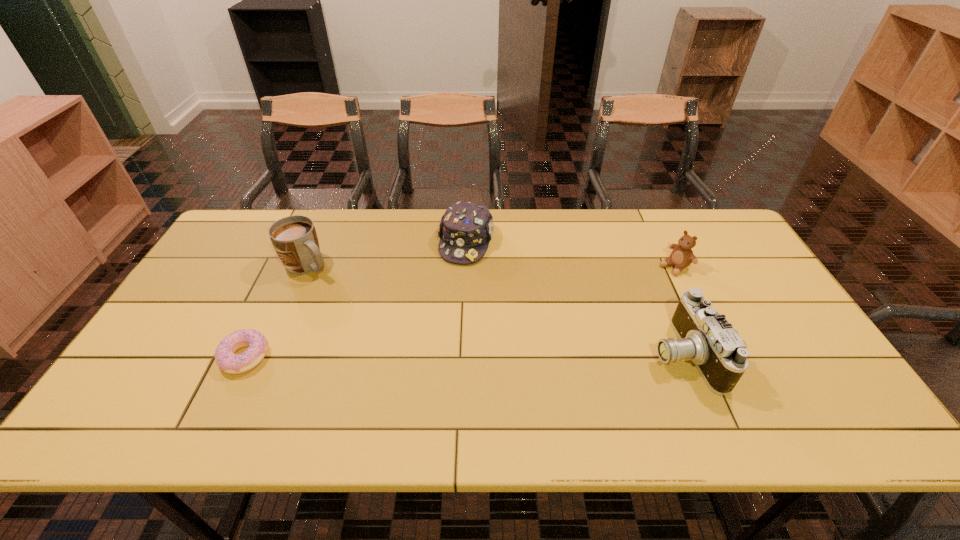
At what (x,y) coordinates should I click in order to perform the action: click on vacant point located between the mug and the third object from right to left. Please return your answer as a coordinate pair (x, y). Looking at the image, I should click on (387, 254).

Where is `blank region between the doughnut and the headwear`? This screenshot has width=960, height=540. blank region between the doughnut and the headwear is located at coordinates (355, 299).

This screenshot has width=960, height=540. Identify the location of free area in between the teddy bear and the headwear. (570, 254).

Locate an element on the screen. This screenshot has height=540, width=960. vacant area that lies between the mug and the camera is located at coordinates (495, 310).

Find the location of `free space between the headwear and the shortest object`. free space between the headwear and the shortest object is located at coordinates (355, 299).

Locate an element on the screen. This screenshot has width=960, height=540. free space between the camera and the headwear is located at coordinates (575, 298).

You are a GUI agent. You are given a task and a screenshot of the screen. Output one action in this format:
    pyautogui.click(x=<x>, y=<y>)
    Task: Click on the unoccupied area between the shortest object and the headwear
    This screenshot has width=960, height=540.
    Given the screenshot: What is the action you would take?
    pyautogui.click(x=355, y=299)

The image size is (960, 540). Find the location of `object that is the nearest to the headwear`. object that is the nearest to the headwear is located at coordinates (294, 238).

Locate which object ranks in proximity to the camera. Please provide its 2D coordinates. Your answer should be formatted as a tuple, i.e. [(x, y)], where the tuple contains the x and y coordinates of a point satisfying the conditions above.

[(682, 255)]

Locate an element on the screen. free region that satisfies the following two spatial constraints: 1. on the back side of the shortest object; 2. on the right side of the third object from right to left is located at coordinates (300, 242).